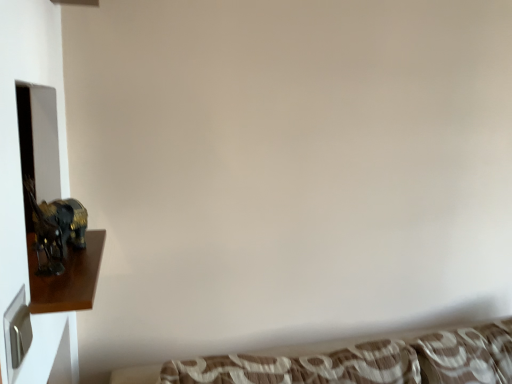
Question: Is brown textured fabric at lower center bigger than shiny gold statue at left?

Choices:
 (A) yes
 (B) no

Answer: (A)

Question: Can you confirm if brown textured fabric at lower center is smaller than shiny gold statue at left?

Choices:
 (A) yes
 (B) no

Answer: (B)

Question: Is the position of brown textured fabric at lower center less distant than that of shiny gold statue at left?

Choices:
 (A) yes
 (B) no

Answer: (B)

Question: Does brown textured fabric at lower center have a greater width compared to shiny gold statue at left?

Choices:
 (A) yes
 (B) no

Answer: (A)

Question: Is brown textured fabric at lower center positioned beyond the bounds of shiny gold statue at left?

Choices:
 (A) no
 (B) yes

Answer: (B)

Question: Is brown textured fabric at lower center far from shiny gold statue at left?

Choices:
 (A) no
 (B) yes

Answer: (A)

Question: Can you confirm if shiny gold statue at left is wider than brown textured fabric at lower center?

Choices:
 (A) yes
 (B) no

Answer: (B)

Question: Is shiny gold statue at left far away from brown textured fabric at lower center?

Choices:
 (A) yes
 (B) no

Answer: (B)

Question: Considering the relative positions of shiny gold statue at left and brown textured fabric at lower center in the image provided, is shiny gold statue at left to the left of brown textured fabric at lower center from the viewer's perspective?

Choices:
 (A) yes
 (B) no

Answer: (A)

Question: Would you say shiny gold statue at left contains brown textured fabric at lower center?

Choices:
 (A) no
 (B) yes

Answer: (A)

Question: Does shiny gold statue at left turn towards brown textured fabric at lower center?

Choices:
 (A) no
 (B) yes

Answer: (A)

Question: From the image's perspective, does shiny gold statue at left appear lower than brown textured fabric at lower center?

Choices:
 (A) no
 (B) yes

Answer: (A)

Question: Relative to shiny gold statue at left, is brown textured fabric at lower center in front or behind?

Choices:
 (A) behind
 (B) front

Answer: (A)